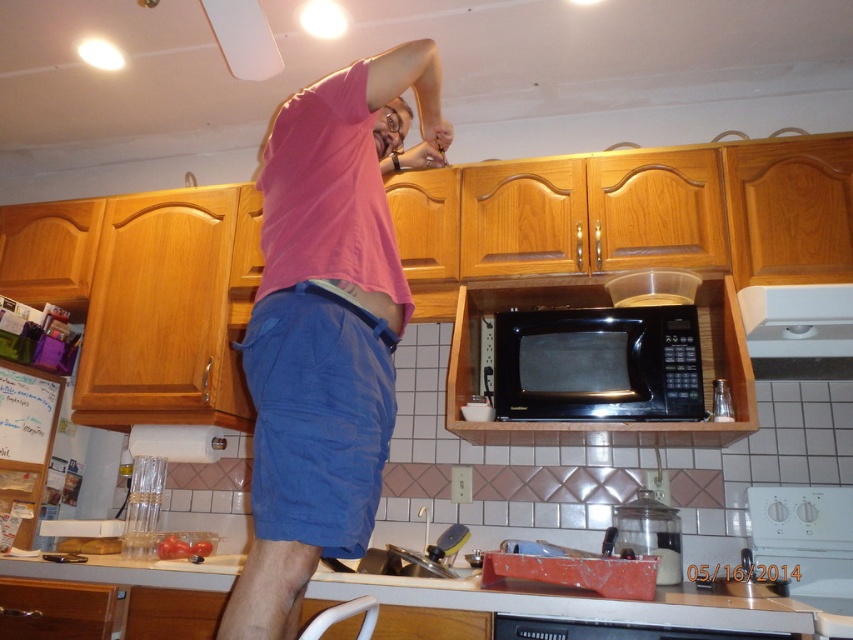
Is black matte microwave at center above white glossy countertop at lower center?

Yes, black matte microwave at center is above white glossy countertop at lower center.

Is black matte microwave at center positioned at the back of white glossy countertop at lower center?

Yes, black matte microwave at center is further from the viewer.

The height and width of the screenshot is (640, 853). Describe the element at coordinates (598, 364) in the screenshot. I see `black matte microwave at center` at that location.

Identify the location of black matte microwave at center. Image resolution: width=853 pixels, height=640 pixels. (598, 364).

Does point (375, 99) lie behind point (465, 609)?

That is False.

Is pink cotton shirt at upper center positioned in front of white glossy countertop at lower center?

Yes.

Who is more forward, [347,189] or [160,576]?

Point [347,189] is more forward.

Locate an element on the screen. This screenshot has width=853, height=640. pink cotton shirt at upper center is located at coordinates (326, 324).

Find the location of a particular element. white glossy countertop at lower center is located at coordinates (595, 604).

Is the position of white glossy countertop at lower center more distant than that of white plastic exhaust hood at upper right?

No, it is in front of white plastic exhaust hood at upper right.

Is point (109, 576) closer to camera compared to point (786, 289)?

Yes, point (109, 576) is closer to viewer.

The height and width of the screenshot is (640, 853). In order to click on white glossy countertop at lower center in this screenshot , I will do `click(595, 604)`.